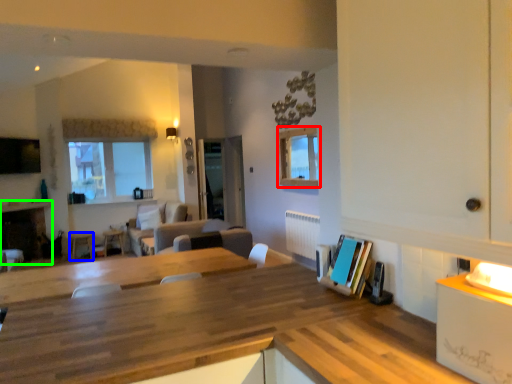
Question: Based on their relative distances, which object is nearer to window (highlighted by a red box)? Choose from chair (highlighted by a blue box) and fireplace (highlighted by a green box).

Choices:
 (A) chair
 (B) fireplace

Answer: (A)